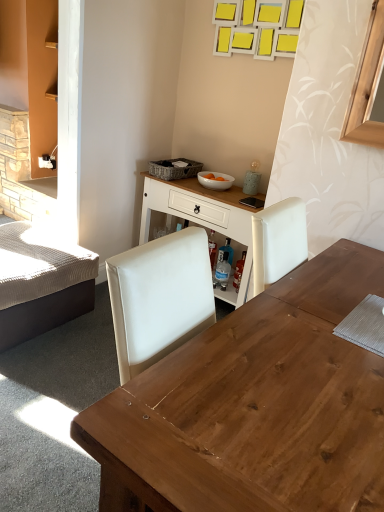
Question: In terms of height, does woven gray picnic basket at upper center look taller or shorter compared to textured beige bed at left?

Choices:
 (A) short
 (B) tall

Answer: (A)

Question: From the image's perspective, is woven gray picnic basket at upper center located above or below textured beige bed at left?

Choices:
 (A) below
 (B) above

Answer: (B)

Question: Which object is the farthest from the wooden desk at center?

Choices:
 (A) white wood table at center
 (B) textured beige bed at left
 (C) white glossy bowl at center
 (D) woven gray picnic basket at upper center

Answer: (D)

Question: Which object is the farthest from the white glossy bowl at center?

Choices:
 (A) woven gray picnic basket at upper center
 (B) textured beige bed at left
 (C) white wood table at center
 (D) wooden desk at center

Answer: (D)